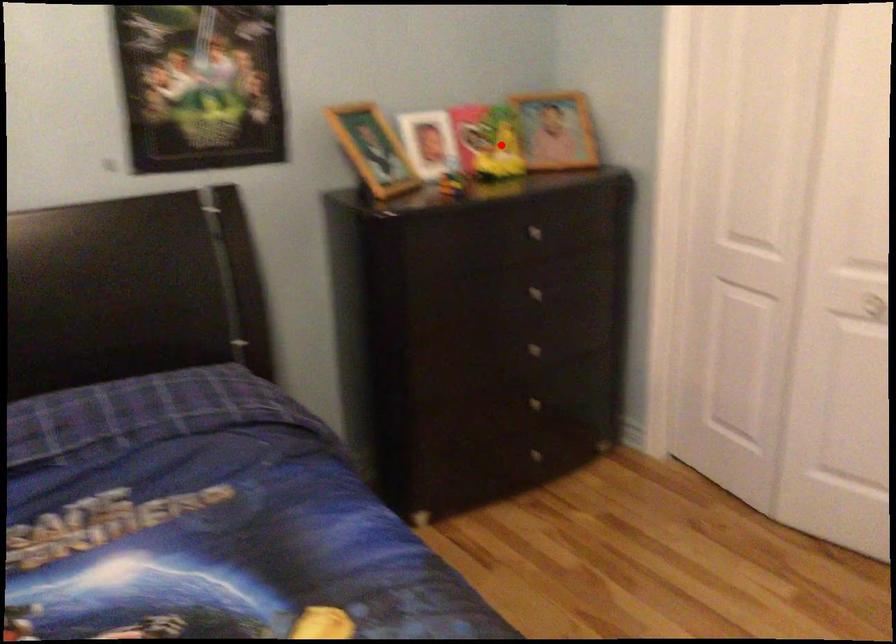
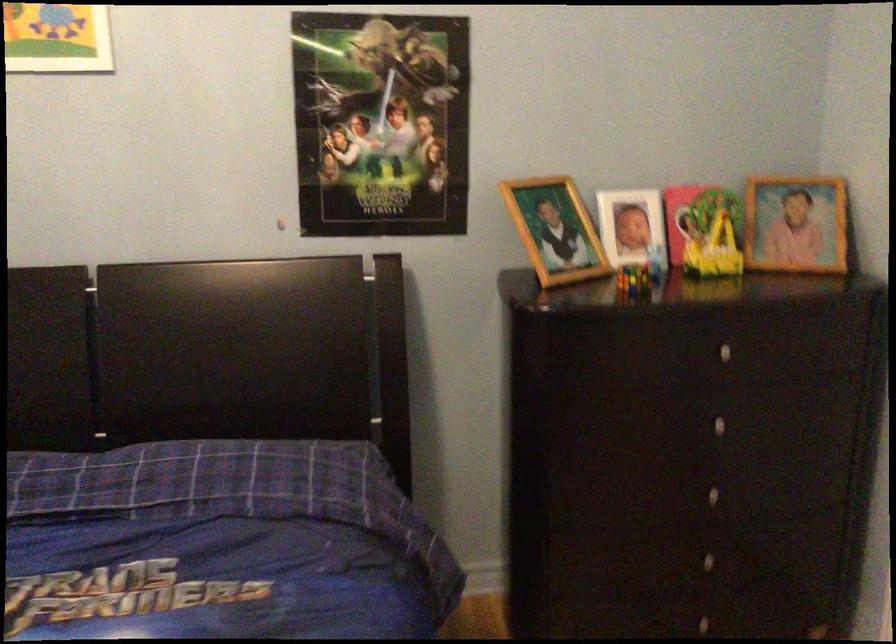
Question: A red point is marked in image1. In image2, is the corresponding 3D point closer to the camera or farther? Reply with the corresponding letter.

Choices:
 (A) The corresponding 3D point is closer.
 (B) The corresponding 3D point is farther.

Answer: (A)